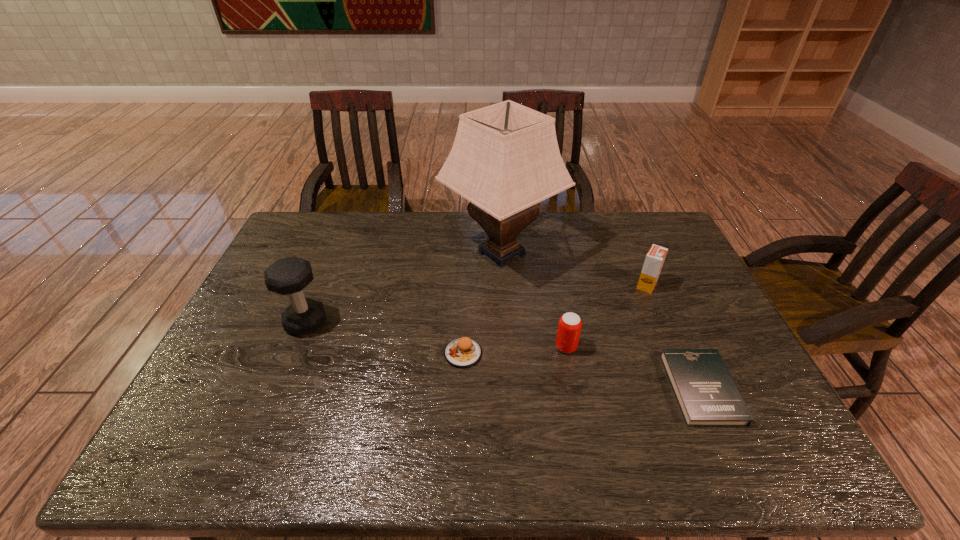
Image resolution: width=960 pixels, height=540 pixels. Find the location of `lampshade`. lampshade is located at coordinates (505, 159).

This screenshot has height=540, width=960. I want to click on dumbbell, so click(x=289, y=276).

Image resolution: width=960 pixels, height=540 pixels. I want to click on the third farthest object, so click(289, 276).

At what (x,y) coordinates should I click in order to perform the action: click on orange juice. Please return your answer as a coordinate pair (x, y). The image size is (960, 540). Looking at the image, I should click on (654, 260).

Find the location of a particular element. the fourth tallest object is located at coordinates (570, 324).

Identify the location of patty. This screenshot has width=960, height=540. (463, 352).

Image resolution: width=960 pixels, height=540 pixels. Find the location of `book`. book is located at coordinates (707, 395).

Identify the location of vacant space situated on the left of the tallest object. This screenshot has height=540, width=960. (347, 253).

The height and width of the screenshot is (540, 960). I want to click on free point located 0.370m on the back of the dumbbell, so click(342, 235).

The width and height of the screenshot is (960, 540). In order to click on free space located on the left of the orange juice in this screenshot , I will do `click(545, 286)`.